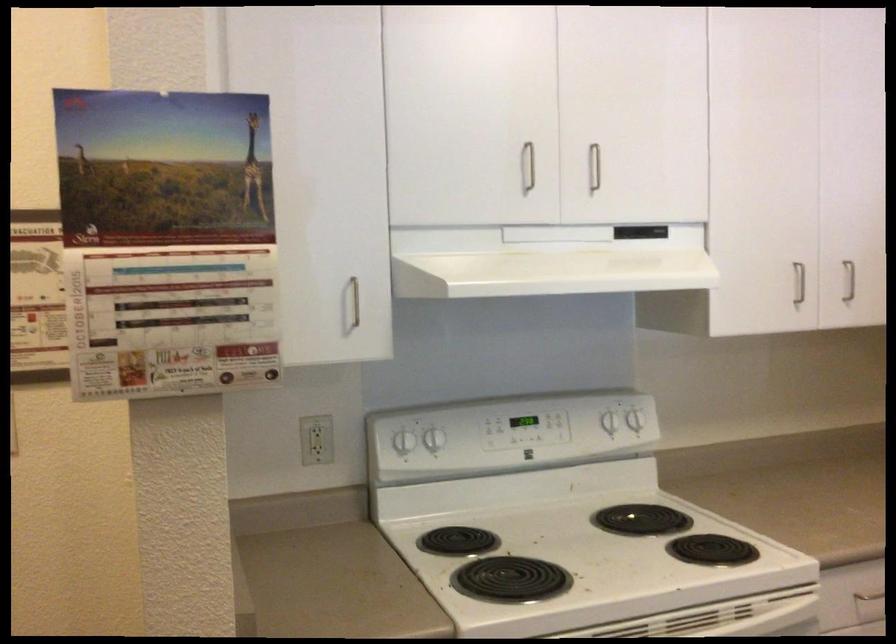
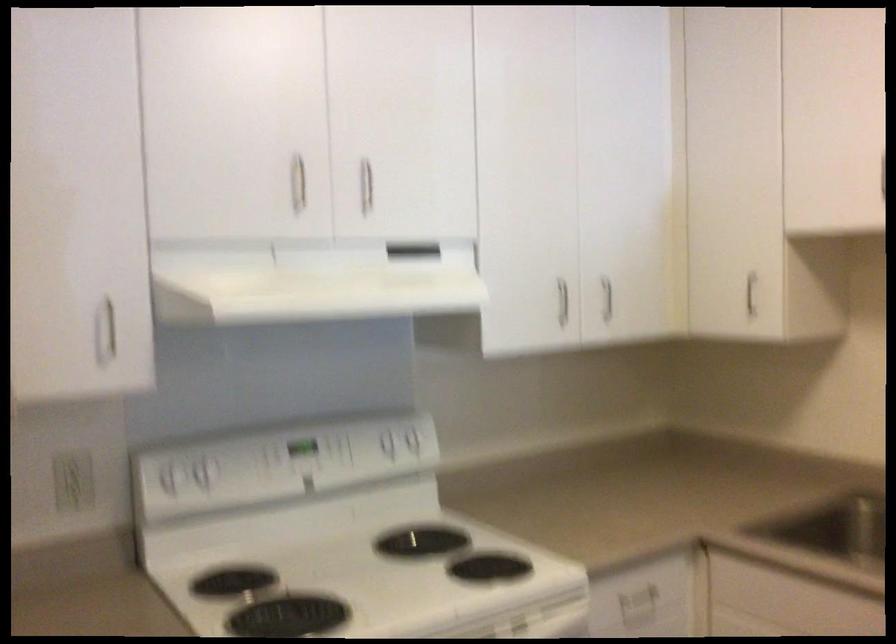
Locate, in the second image, the point that corresponds to pixel 606 418 in the first image.

(385, 440)